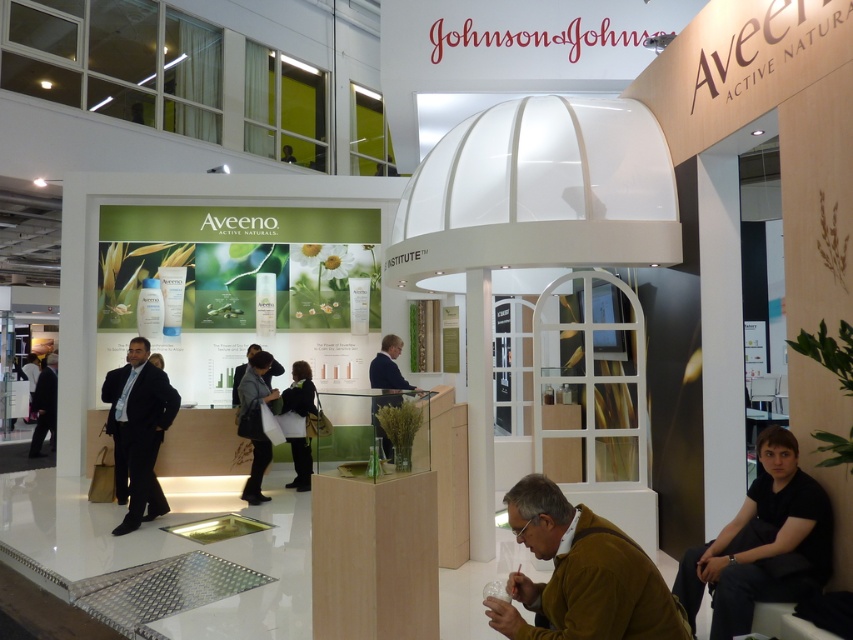
You are a photographer standing in the exhibition space and want to take a photo of the black cotton shirt at lower right and the white wood pillar at center. Which object will appear taller in the photo?

The white wood pillar at center will appear taller in the photo because it is taller than the black cotton shirt at lower right.

You are an attendee at the trade show and you see the dark suit at center and the black fabric bag at center. Which one is more to the left?

The dark suit at center is positioned on the left side of the black fabric bag at center, so it is more to the left.